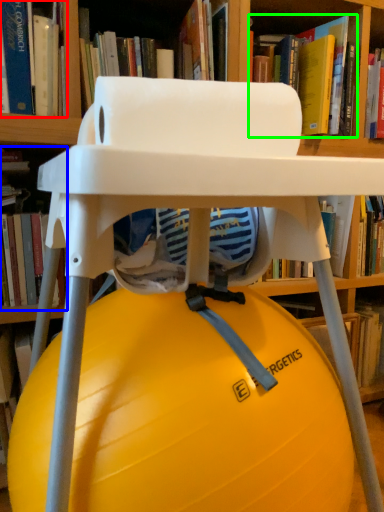
Question: Which object is positioned farthest from book (highlighted by a red box)? Select from book (highlighted by a blue box) and book (highlighted by a green box).

Choices:
 (A) book
 (B) book

Answer: (B)